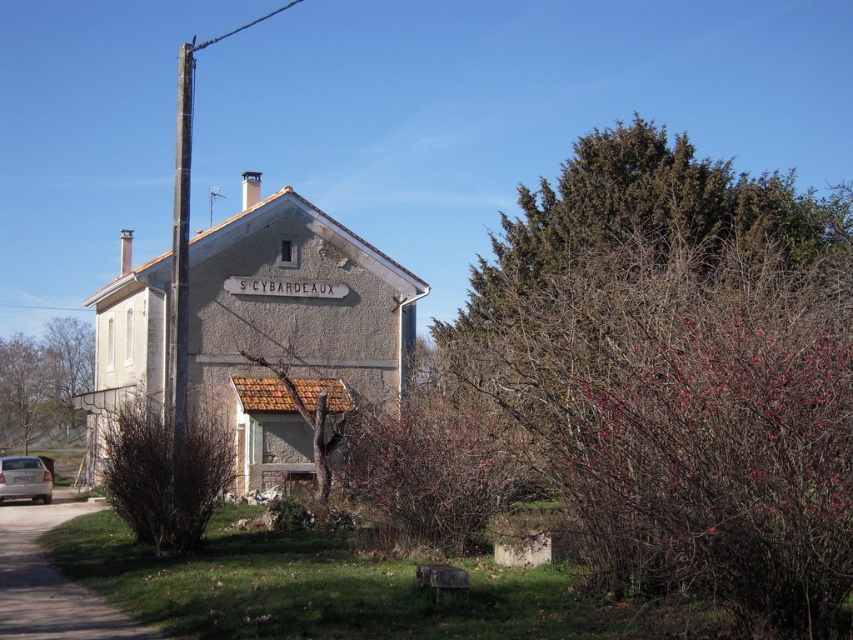
Looking at this image, you are standing in front of the building and notice the smooth gray pole at left and the silver metallic car at lower left. Which object is positioned more to the left side of the scene?

The smooth gray pole at left is positioned more to the left side of the scene compared to the silver metallic car at lower left.

You are standing in front of the building and notice the bare branches at left and the silver metallic car at lower left. Which object is closer to you?

The bare branches at left are closer to you because they are further to the viewer than the silver metallic car at lower left, meaning they appear nearer in the visual perspective.